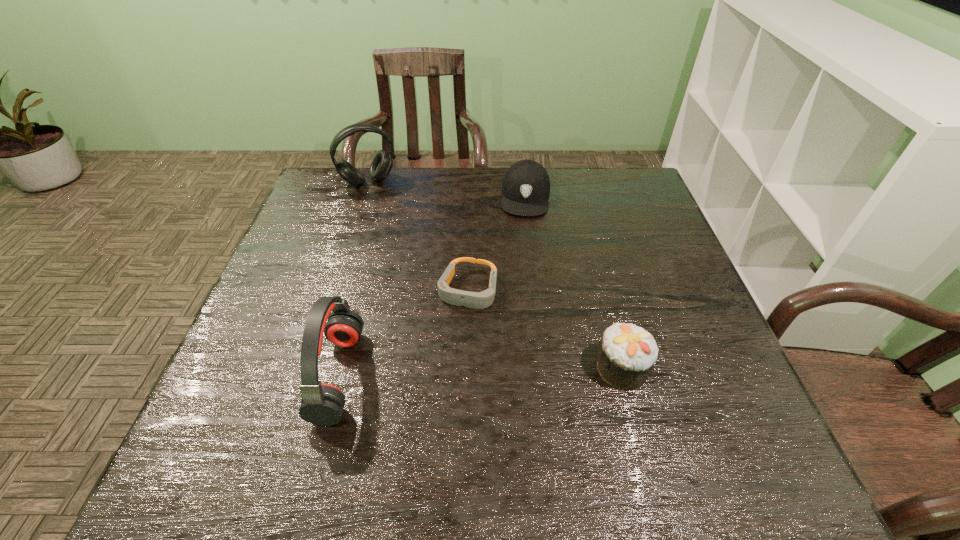
What are the coordinates of `earphone` in the screenshot? It's located at (322, 404).

This screenshot has height=540, width=960. What are the coordinates of `the rightmost object` in the screenshot? It's located at (627, 353).

Where is `the second object from right to left`? The height and width of the screenshot is (540, 960). the second object from right to left is located at coordinates (526, 185).

You are a GUI agent. You are given a task and a screenshot of the screen. Output one action in this format:
    pyautogui.click(x=<x>, y=<y>)
    Task: Click on the goggles
    
    Given the screenshot: What is the action you would take?
    pyautogui.click(x=477, y=300)

The image size is (960, 540). In order to click on the third object from right to left in this screenshot , I will do click(477, 300).

Locate an element on the screen. headset is located at coordinates (382, 163).

Locate an element on the screen. The image size is (960, 540). free spot located on the ear cups of the earphone is located at coordinates (396, 375).

Locate an element on the screen. Image resolution: width=960 pixels, height=540 pixels. free spot located 0.150m on the left of the rightmost object is located at coordinates (522, 368).

At what (x,y) coordinates should I click in order to perform the action: click on vacant space situated 0.260m on the front-facing side of the fourth object from left to right. Please return your answer as a coordinate pair (x, y). This screenshot has width=960, height=540. Looking at the image, I should click on point(519,283).

The height and width of the screenshot is (540, 960). What are the coordinates of `vacant space located 0.320m on the front-facing side of the fourth object from left to right` in the screenshot? It's located at 517,301.